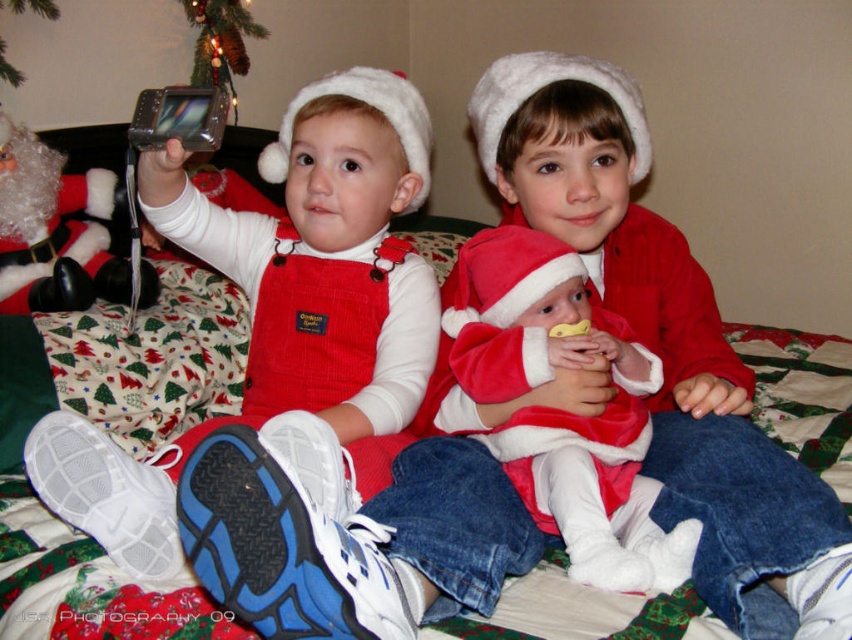
Can you confirm if corduroy red overalls at left is positioned to the left of velvet red santa suit at center?

Correct, you'll find corduroy red overalls at left to the left of velvet red santa suit at center.

Is corduroy red overalls at left shorter than velvet red santa suit at center?

In fact, corduroy red overalls at left may be taller than velvet red santa suit at center.

What do you see at coordinates (666, 344) in the screenshot? The image size is (852, 640). I see `corduroy red overalls at left` at bounding box center [666, 344].

At what (x,y) coordinates should I click in order to perform the action: click on corduroy red overalls at left. Please return your answer as a coordinate pair (x, y). Looking at the image, I should click on (666, 344).

Which is in front, point (530, 492) or point (19, 308)?

Positioned in front is point (530, 492).

Does velvet red santa suit at center appear over fuzzy white santa at left?

No.

Measure the distance between point [588,422] and camera.

A distance of 36.60 inches exists between point [588,422] and camera.

This screenshot has height=640, width=852. Find the location of `velvet red santa suit at center`. velvet red santa suit at center is located at coordinates (563, 412).

Between point (470, 513) and point (158, 208), which one is positioned behind?

The point (158, 208) is behind.

Is corduroy red overalls at left wider than matte red overalls at lower left?

Yes, corduroy red overalls at left is wider than matte red overalls at lower left.

Is point (602, 284) behind point (255, 369)?

No.

Locate an element on the screen. corduroy red overalls at left is located at coordinates (666, 344).